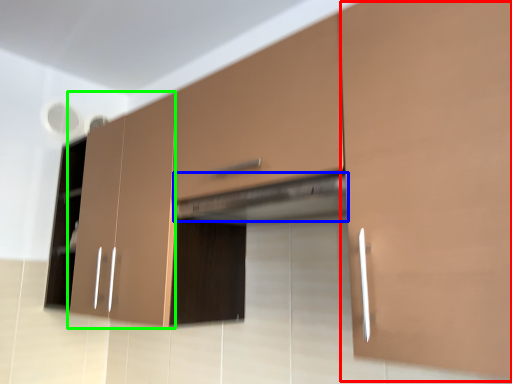
Question: Considering the real-world distances, which object is farthest from cabinetry (highlighted by a red box)? exhaust hood (highlighted by a blue box) or cabinetry (highlighted by a green box)?

Choices:
 (A) exhaust hood
 (B) cabinetry

Answer: (B)